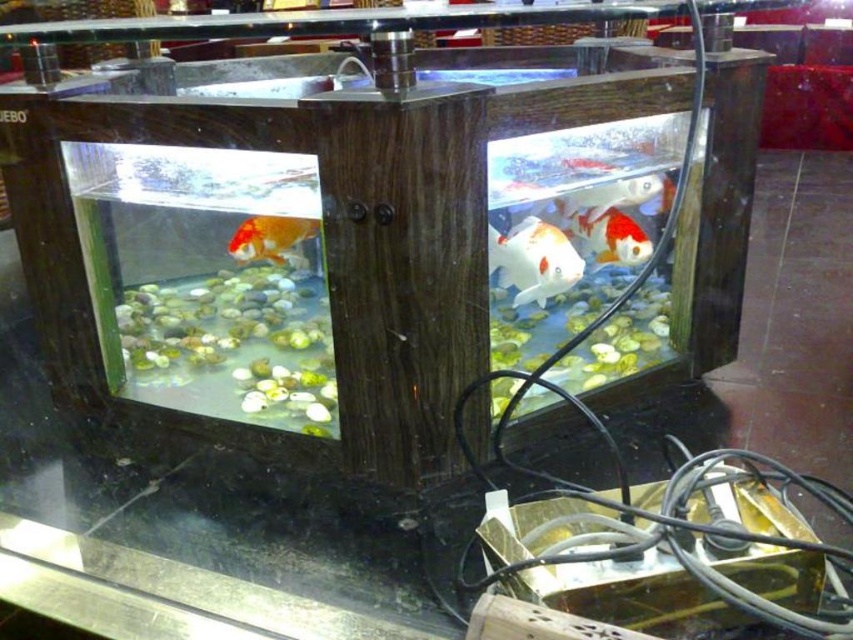
Which of these two, shiny orange and white fish at upper right or shiny orange and white fish at right, stands shorter?

shiny orange and white fish at right is shorter.

Is shiny orange and white fish at upper right below shiny orange and white fish at right?

Yes, shiny orange and white fish at upper right is below shiny orange and white fish at right.

I want to click on shiny orange and white fish at upper right, so click(610, 195).

Image resolution: width=853 pixels, height=640 pixels. What are the coordinates of `shiny orange and white fish at upper right` in the screenshot? It's located at (610, 195).

Is shiny orange and white fish at center right thinner than shiny orange and white fish at right?

No.

Does point (616, 230) come farther from viewer compared to point (572, 157)?

Yes.

Locate an element on the screen. shiny orange and white fish at center right is located at coordinates (612, 237).

You are a GUI agent. You are given a task and a screenshot of the screen. Output one action in this format:
    pyautogui.click(x=<x>, y=<y>)
    Task: Click on the shiny orange and white fish at center right
    The height and width of the screenshot is (640, 853).
    Given the screenshot: What is the action you would take?
    pyautogui.click(x=612, y=237)

Is point (276, 257) farther from viewer compared to point (625, 192)?

Yes, point (276, 257) is farther from viewer.

This screenshot has width=853, height=640. What do you see at coordinates (270, 237) in the screenshot?
I see `shiny orange goldfish at left` at bounding box center [270, 237].

Locate an element on the screen. Image resolution: width=853 pixels, height=640 pixels. shiny orange goldfish at left is located at coordinates (270, 237).